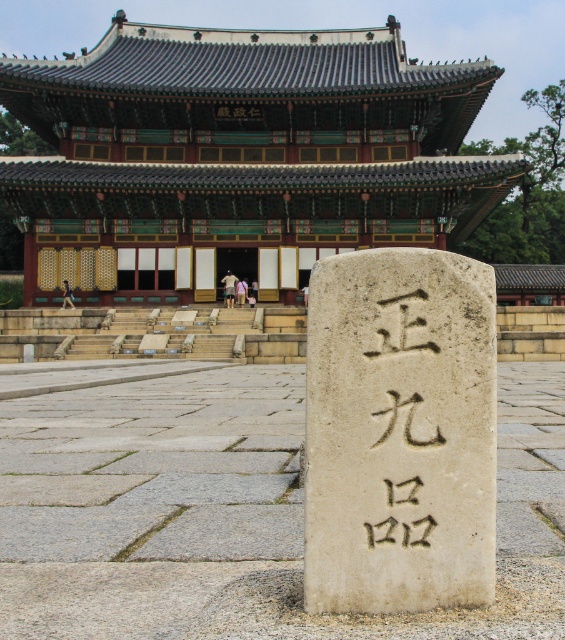
Question: Which is nearer to the green wooden palace at upper center?

Choices:
 (A) black stone carving at center
 (B) white stone marker at center
 (C) white stone pillar at center

Answer: (B)

Question: Can you confirm if green wooden palace at upper center is positioned to the right of white stone marker at center?

Choices:
 (A) no
 (B) yes

Answer: (A)

Question: Estimate the real-world distances between objects in this image. Which object is closer to the green wooden palace at upper center?

Choices:
 (A) black stone carving at center
 (B) white stone marker at center

Answer: (B)

Question: Which of these objects is positioned farthest from the green wooden palace at upper center?

Choices:
 (A) white stone pillar at center
 (B) black stone carving at center
 (C) white stone marker at center

Answer: (B)

Question: Can you confirm if white stone marker at center is bigger than black stone carving at center?

Choices:
 (A) yes
 (B) no

Answer: (A)

Question: Can you confirm if green wooden palace at upper center is positioned to the right of white stone marker at center?

Choices:
 (A) yes
 (B) no

Answer: (B)